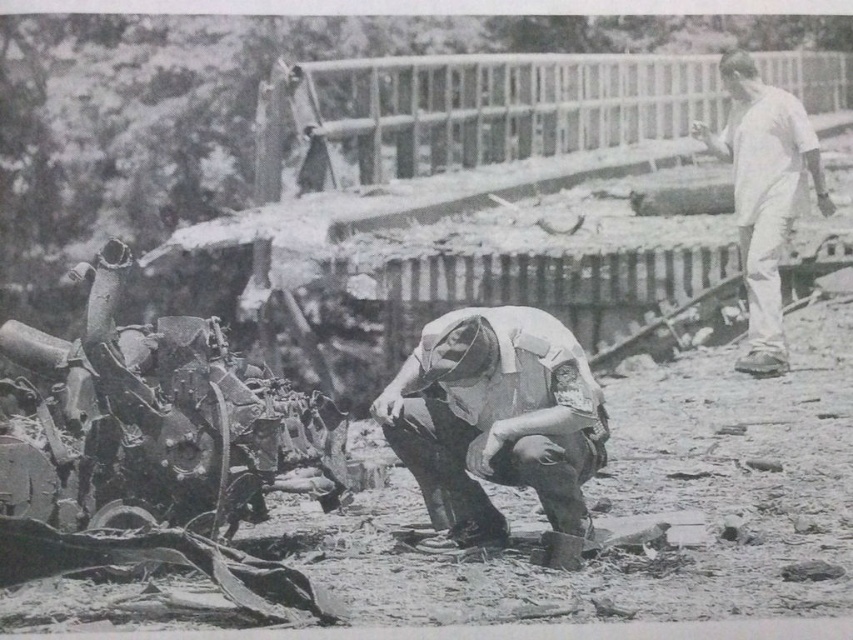
Question: Can you confirm if rusty metal tank at lower left is positioned above white fabric uniform at center?

Choices:
 (A) no
 (B) yes

Answer: (B)

Question: Which point appears farthest from the camera in this image?

Choices:
 (A) (439, 440)
 (B) (811, 138)

Answer: (B)

Question: Where is white fabric uniform at center located in relation to white cotton shirt at upper right in the image?

Choices:
 (A) left
 (B) right

Answer: (A)

Question: Does rusty metal tank at lower left have a smaller size compared to white cotton shirt at upper right?

Choices:
 (A) yes
 (B) no

Answer: (B)

Question: Based on their relative distances, which object is farther from the rusty metal tank at lower left?

Choices:
 (A) white fabric uniform at center
 (B) white cotton shirt at upper right

Answer: (B)

Question: Which point is farther from the camera taking this photo?

Choices:
 (A) (508, 465)
 (B) (782, 369)

Answer: (B)